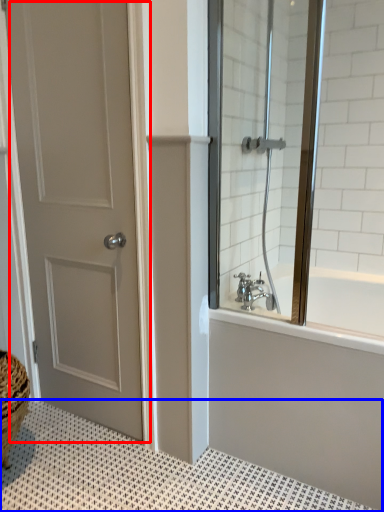
Question: Which object appears farthest to the camera in this image, door (highlighted by a red box) or bath mat (highlighted by a blue box)?

Choices:
 (A) door
 (B) bath mat

Answer: (A)